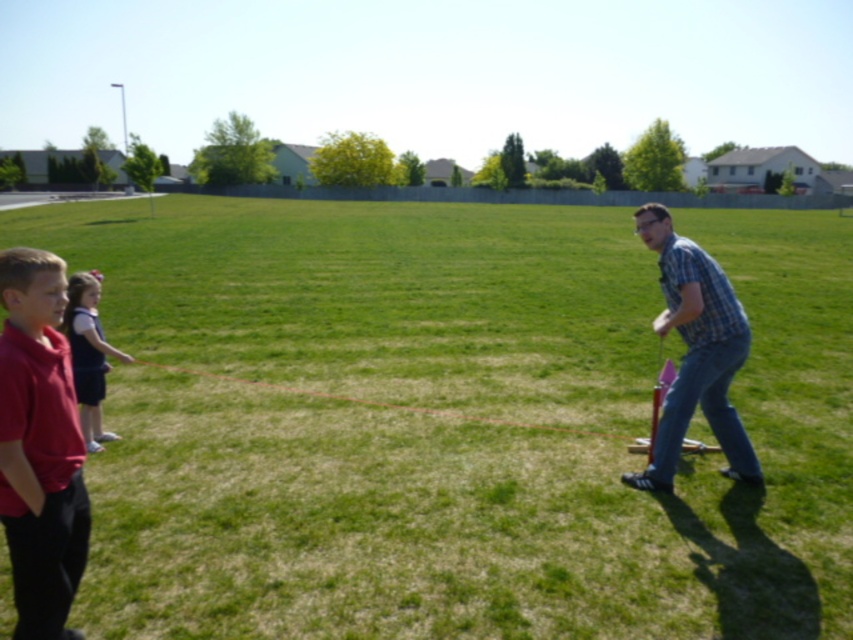
Question: Is plaid shirt at right thinner than dark blue dress at left?

Choices:
 (A) no
 (B) yes

Answer: (A)

Question: Can you confirm if matte red shirt at left is thinner than dark blue dress at left?

Choices:
 (A) yes
 (B) no

Answer: (A)

Question: Is matte red shirt at left positioned in front of plaid shirt at right?

Choices:
 (A) no
 (B) yes

Answer: (B)

Question: Which point is farther to the camera?

Choices:
 (A) green grassy field at center
 (B) matte red shirt at left
 (C) dark blue dress at left

Answer: (C)

Question: Among these objects, which one is nearest to the camera?

Choices:
 (A) matte red shirt at left
 (B) plaid shirt at right
 (C) red string at center
 (D) green grassy field at center

Answer: (A)

Question: Which object appears farthest from the camera in this image?

Choices:
 (A) matte red shirt at left
 (B) dark blue dress at left

Answer: (B)